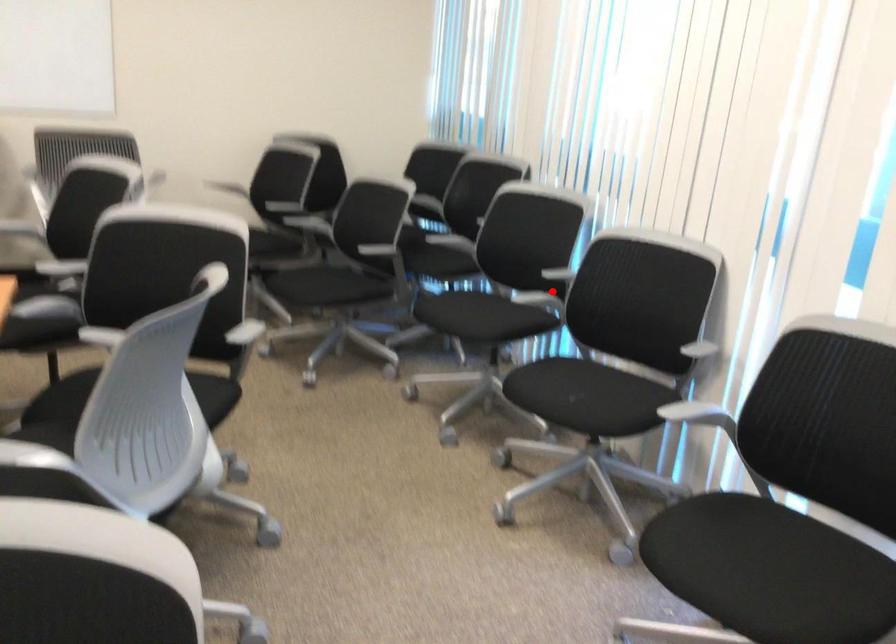
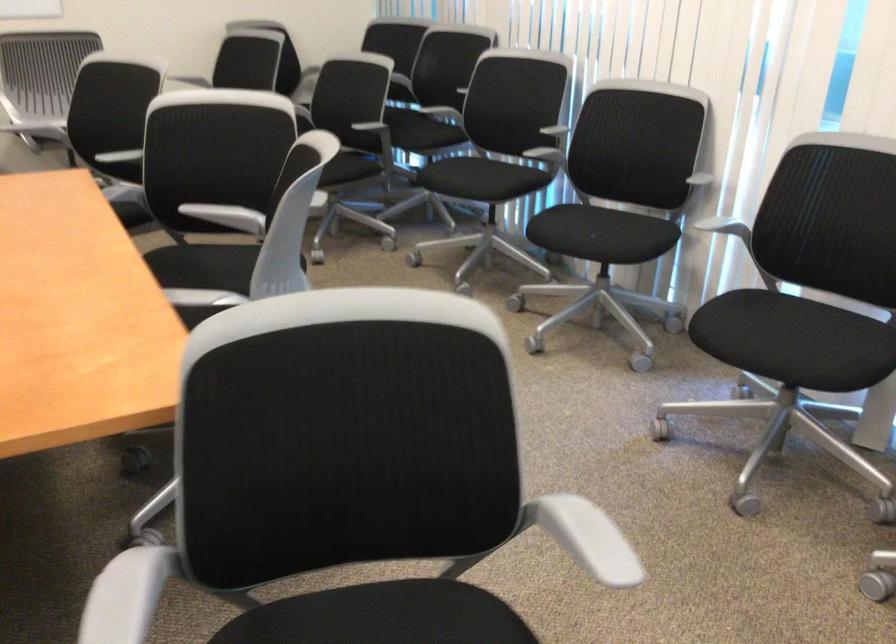
Where in the second image is the point corresponding to the highlighted location from the first image?

(543, 146)